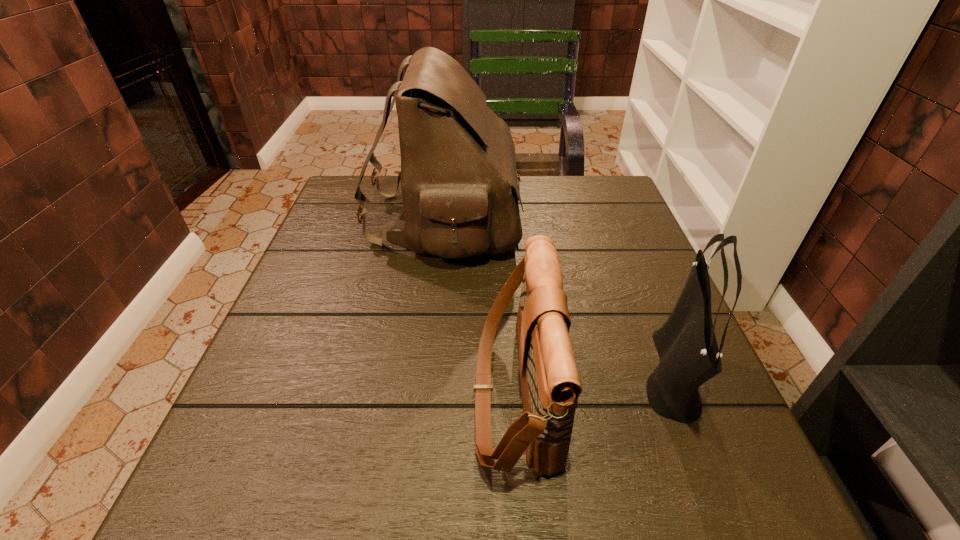
Where is `free region that satisfies the following two spatial constraints: 1. on the back side of the second tallest object; 2. on the front flap of the satchel`? The width and height of the screenshot is (960, 540). free region that satisfies the following two spatial constraints: 1. on the back side of the second tallest object; 2. on the front flap of the satchel is located at coordinates (609, 220).

Find the location of a particular element. This screenshot has width=960, height=540. vacant position in the image that satisfies the following two spatial constraints: 1. on the front flap of the second shortest object; 2. on the right side of the tallest object is located at coordinates (428, 375).

At what (x,y) coordinates should I click in order to perform the action: click on free spot that satisfies the following two spatial constraints: 1. on the back side of the second tallest object; 2. on the front flap of the farthest object. Please return your answer as a coordinate pair (x, y). The image size is (960, 540). Looking at the image, I should click on (609, 220).

I want to click on vacant space that satisfies the following two spatial constraints: 1. on the front flap of the second tallest object; 2. on the right side of the farthest object, so click(428, 375).